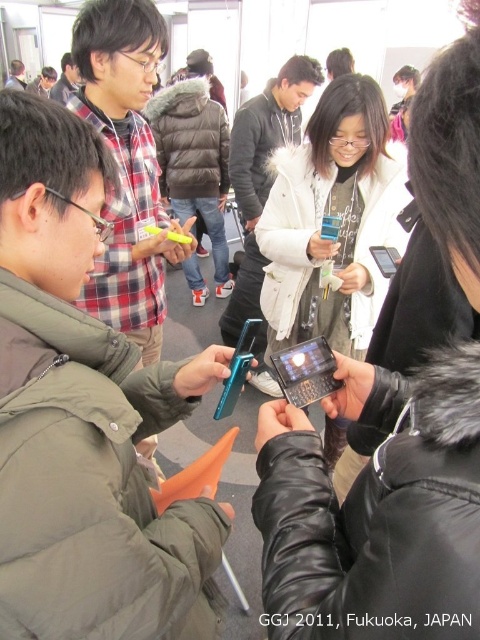
Who is more forward, (x=127, y=180) or (x=241, y=161)?

Positioned in front is point (x=127, y=180).

Which of these two, matte green jacket at left or white fur-trimmed coat at center, stands shorter?

Standing shorter between the two is matte green jacket at left.

Who is more distant from viewer, (80, 19) or (257, 132)?

The point (257, 132) is behind.

Where is `matte green jacket at left`? Image resolution: width=480 pixels, height=640 pixels. matte green jacket at left is located at coordinates (127, 164).

Which is below, matte plaid shirt at upper left or matte black jacket at upper center?

Positioned lower is matte plaid shirt at upper left.

Which of these two, matte plaid shirt at upper left or matte black jacket at upper center, stands taller?

matte plaid shirt at upper left is taller.

The width and height of the screenshot is (480, 640). What do you see at coordinates (66, 81) in the screenshot? I see `matte plaid shirt at upper left` at bounding box center [66, 81].

I want to click on matte plaid shirt at upper left, so click(66, 81).

Who is positioned more to the right, white fur-trimmed coat at center or matte plaid shirt at upper left?

white fur-trimmed coat at center

Image resolution: width=480 pixels, height=640 pixels. I want to click on white fur-trimmed coat at center, so click(262, 173).